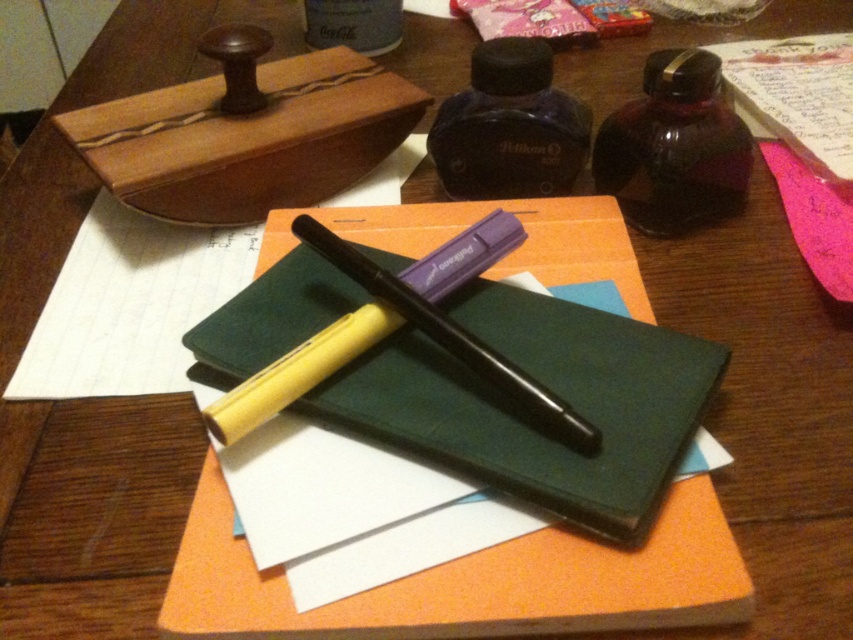
Is point (672, 74) positioned behind point (329, 372)?

Yes.

Does translucent amber bottle at upper right appear on the right side of black plastic pen at center?

Correct, you'll find translucent amber bottle at upper right to the right of black plastic pen at center.

Is point (747, 140) closer to camera compared to point (485, 228)?

No, it is not.

The image size is (853, 640). Identify the location of translucent amber bottle at upper right. (674, 147).

Does translucent amber bottle at upper right have a lesser width compared to matte black bottle at upper center?

In fact, translucent amber bottle at upper right might be wider than matte black bottle at upper center.

Can you confirm if translucent amber bottle at upper right is bigger than matte black bottle at upper center?

Indeed, translucent amber bottle at upper right has a larger size compared to matte black bottle at upper center.

Locate an element on the screen. translucent amber bottle at upper right is located at coordinates (674, 147).

Is point (660, 403) more distant than point (718, 86)?

No.

Where is `green matte notebook at center`? The width and height of the screenshot is (853, 640). green matte notebook at center is located at coordinates (525, 413).

Which is behind, point (622, 458) or point (698, 81)?

The point (698, 81) is behind.

This screenshot has height=640, width=853. Identify the location of green matte notebook at center. (525, 413).